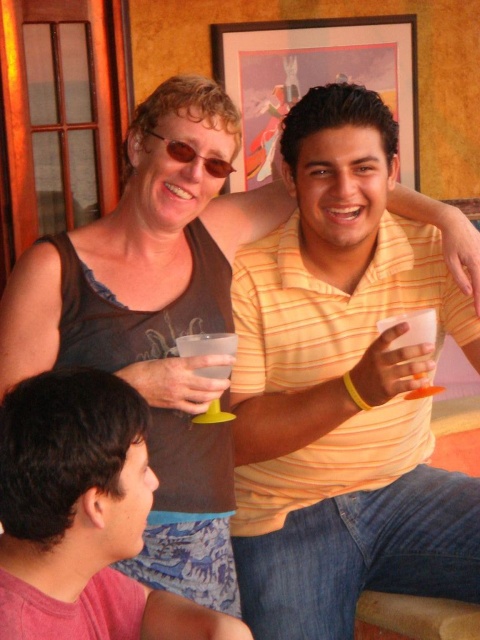
Can you confirm if pink fabric shirt at lower left is thinner than clear plastic cup at upper center?

In fact, pink fabric shirt at lower left might be wider than clear plastic cup at upper center.

Is point (58, 595) closer to viewer compared to point (219, 419)?

Yes, it is in front of point (219, 419).

At what (x,y) coordinates should I click in order to perform the action: click on pink fabric shirt at lower left. Please return your answer as a coordinate pair (x, y). The width and height of the screenshot is (480, 640). Looking at the image, I should click on (83, 515).

Is pink fabric shirt at lower left wider than matte brown sunglasses at upper center?

Yes.

The width and height of the screenshot is (480, 640). Identify the location of pink fabric shirt at lower left. (83, 515).

Who is more forward, (163, 620) or (215, 164)?

Point (163, 620)

I want to click on pink fabric shirt at lower left, so click(83, 515).

Is clear plastic cup at upper center bigger than matte brown sunglasses at upper center?

No.

Measure the distance between clear plastic cup at upper center and matte brown sunglasses at upper center.

20.19 inches

Is point (217, 369) more distant than point (175, 144)?

Yes.

This screenshot has height=640, width=480. What are the coordinates of `clear plastic cup at upper center` in the screenshot? It's located at (206, 344).